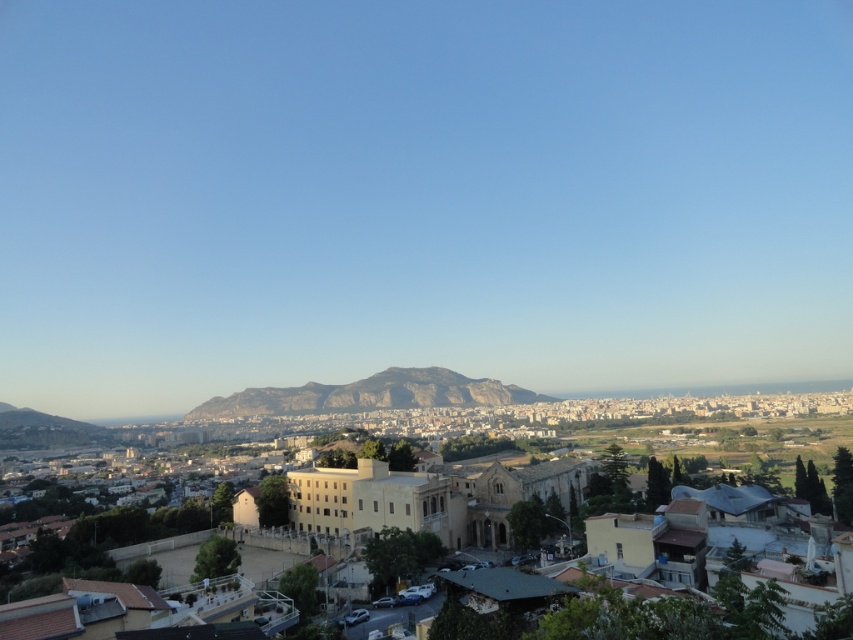
Question: Which of the following is the closest to the observer?

Choices:
 (A) (322, 388)
 (B) (511, 500)

Answer: (B)

Question: Does beige stone church at center have a greater width compared to rugged brown rock at center?

Choices:
 (A) no
 (B) yes

Answer: (B)

Question: Is beige stone church at center further to camera compared to rugged brown rock at center?

Choices:
 (A) no
 (B) yes

Answer: (A)

Question: In this image, where is beige stone church at center located relative to rugged brown rock at center?

Choices:
 (A) below
 (B) above

Answer: (B)